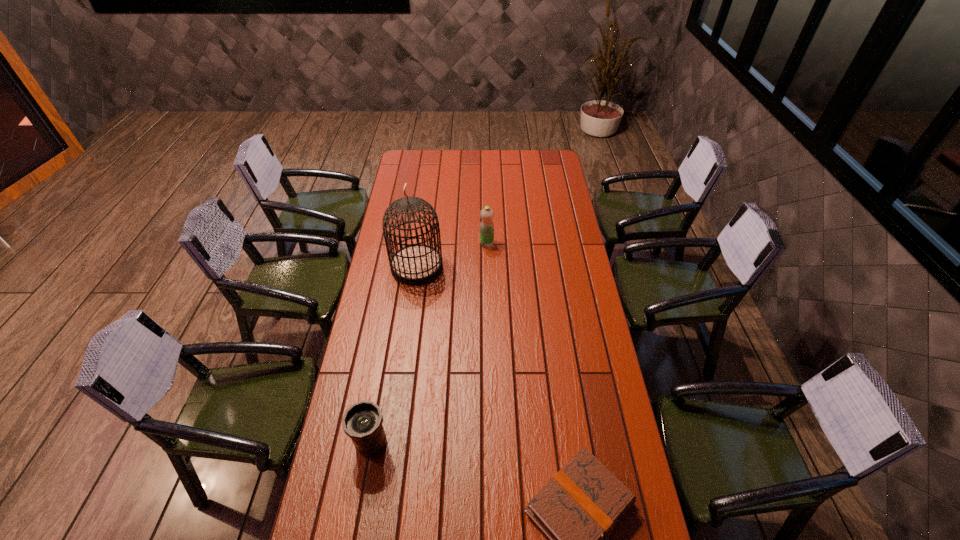
The image size is (960, 540). I want to click on free spot between the second farthest object and the water bottle, so click(x=452, y=255).

This screenshot has height=540, width=960. In order to click on vacant point located between the telephoto lens and the water bottle in this screenshot , I will do `click(429, 343)`.

Choose which object is the nearest neighbor to the third object from left to right. Please provide its 2D coordinates. Your answer should be formatted as a tuple, i.e. [(x, y)], where the tuple contains the x and y coordinates of a point satisfying the conditions above.

[(415, 264)]

Where is `object that stands as the second closest to the second object from right to left`? object that stands as the second closest to the second object from right to left is located at coordinates (362, 421).